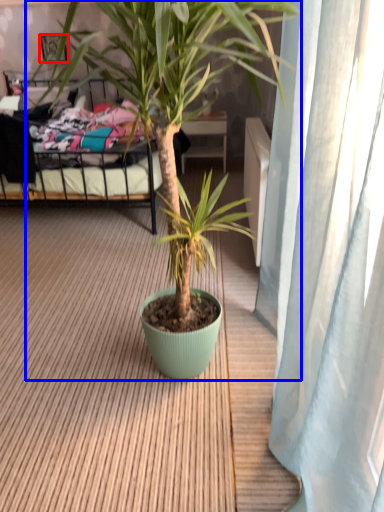
Question: Among these objects, which one is farthest to the camera, picture frame (highlighted by a red box) or houseplant (highlighted by a blue box)?

Choices:
 (A) picture frame
 (B) houseplant

Answer: (A)